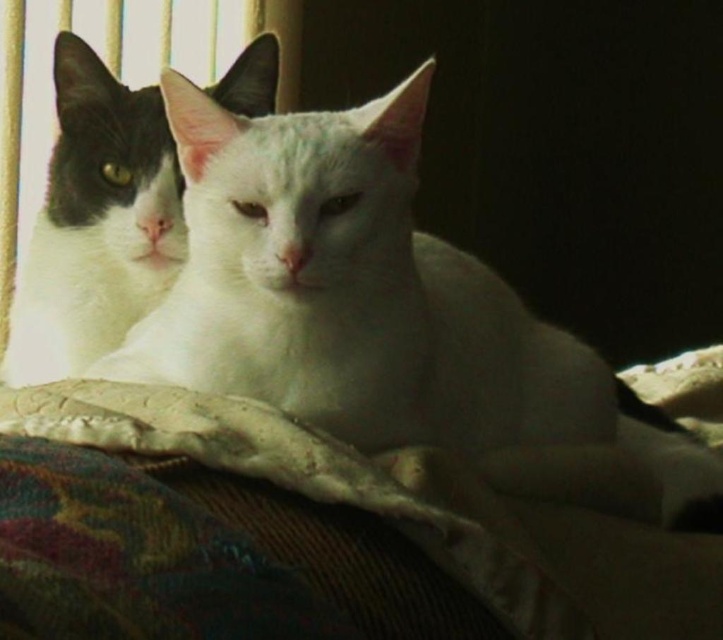
You are a photographer trying to capture the white soft fur cat at center in the image. The camera is positioned at the window with vertical blinds. Can you determine if the point at coordinates (372,301) is the correct location to focus on for the cat?

Yes, the point at coordinates (372,301) corresponds to the white soft fur cat at center, so focusing there will capture the cat accurately.

You are a small toy placed between the white soft fur cat at center and the black and white fur cat at left. If you want to move to the nearest cat, which one should you choose?

The white soft fur cat at center is 22.14 centimeters away from the black and white fur cat at left. Since you are between them, you are closer to whichever cat is nearer. However, the distance between the two cats is fixed at 22.14 cm, so without knowing your exact position between them, it cannot be determined which cat is closer. Please provide more information about your position.